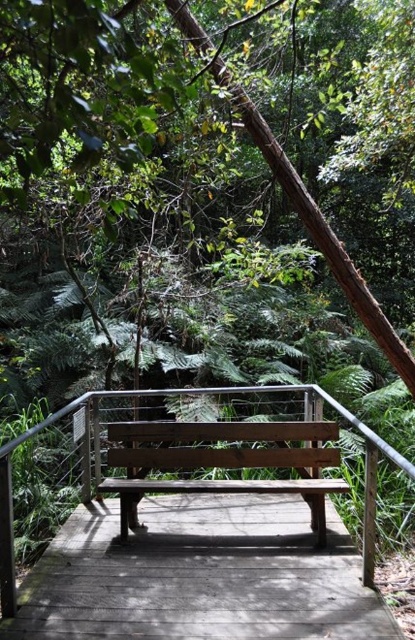
Question: Where is weathered wood bench at center located in relation to wooden bench at center in the image?

Choices:
 (A) right
 (B) left

Answer: (B)

Question: Among these points, which one is nearest to the camera?

Choices:
 (A) (258, 467)
 (B) (249, 536)

Answer: (B)

Question: Can you confirm if weathered wood bench at center is bigger than wooden bench at center?

Choices:
 (A) yes
 (B) no

Answer: (B)

Question: Is weathered wood bench at center closer to the viewer compared to wooden bench at center?

Choices:
 (A) yes
 (B) no

Answer: (A)